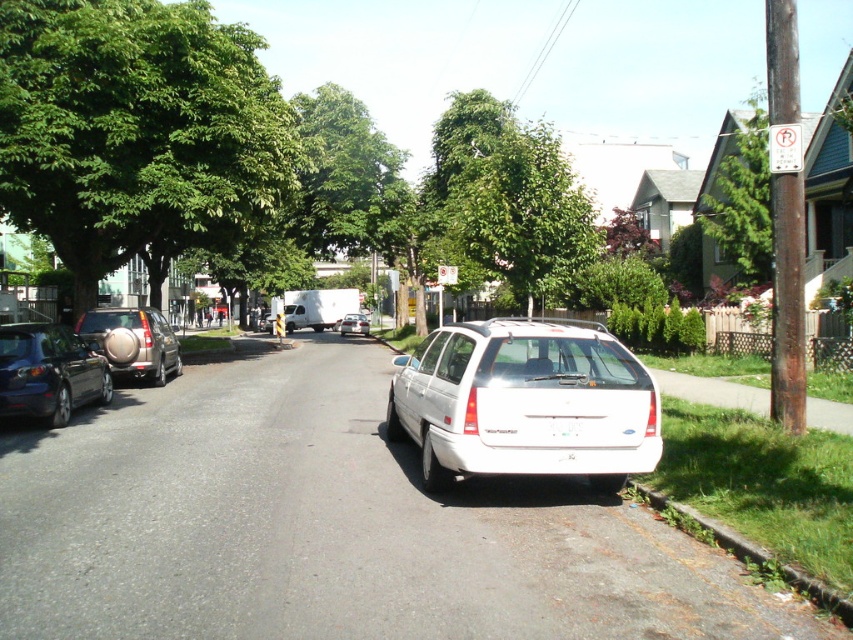
Question: Which of the following is the closest to the observer?

Choices:
 (A) matte silver suv at left
 (B) white matte wagon at center
 (C) green textured tree at upper right
 (D) matte black sedan at left

Answer: (B)

Question: Is green leafy tree at upper left above matte silver suv at left?

Choices:
 (A) yes
 (B) no

Answer: (A)

Question: Does green leafy tree at center have a greater width compared to matte black sedan at left?

Choices:
 (A) yes
 (B) no

Answer: (A)

Question: Which is farther from the green textured tree at upper right?

Choices:
 (A) matte black sedan at left
 (B) green leafy tree at upper left

Answer: (A)

Question: Is white plastic license plate at center thinner than white matte hatchback at center?

Choices:
 (A) no
 (B) yes

Answer: (B)

Question: Which object is positioned closest to the white plastic license plate at center?

Choices:
 (A) white matte wagon at center
 (B) green leafy tree at upper left

Answer: (A)